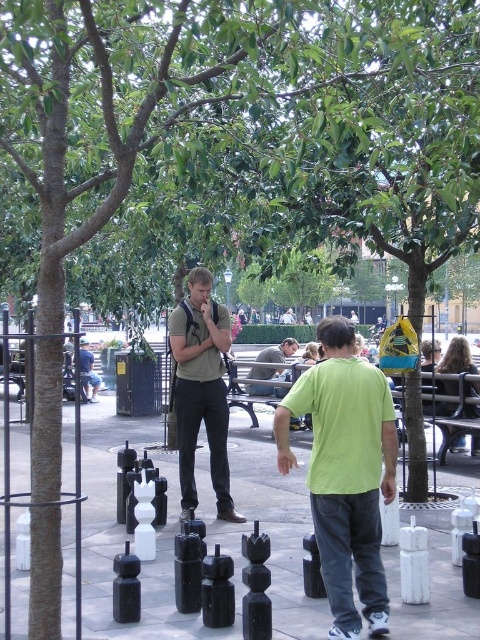
Which is more to the right, matte green t-shirt at center or blonde hair at center?

blonde hair at center is more to the right.

Can you confirm if matte green t-shirt at center is positioned to the right of blonde hair at center?

No, matte green t-shirt at center is not to the right of blonde hair at center.

Between point (193, 355) and point (456, 353), which one is positioned in front?

Point (193, 355) is in front.

This screenshot has height=640, width=480. In order to click on matte green t-shirt at center in this screenshot , I will do `click(202, 388)`.

Between point (459, 371) and point (92, 372), which one is positioned behind?

The point (92, 372) is behind.

Does point (453, 340) come closer to viewer compared to point (90, 384)?

Yes, it is in front of point (90, 384).

Locate an element on the screen. The image size is (480, 640). blonde hair at center is located at coordinates (456, 356).

The height and width of the screenshot is (640, 480). Identify the location of light green t-shirt at center. (345, 472).

At what (x,y) coordinates should I click in order to perform the action: click on light green t-shirt at center. Please return your answer as a coordinate pair (x, y). Looking at the image, I should click on (345, 472).

Where is `light green t-shirt at center`? light green t-shirt at center is located at coordinates 345,472.